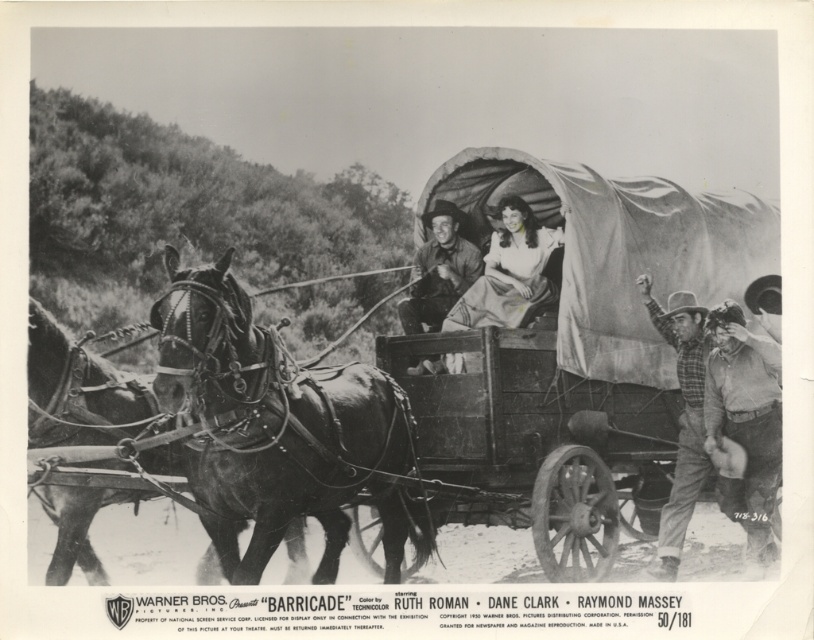
Is point (200, 356) in front of point (445, 296)?

Yes.

Who is more distant from viewer, (344,534) or (441,253)?

The point (441,253) is behind.

What do you see at coordinates (278, 429) in the screenshot? The height and width of the screenshot is (640, 814). I see `shiny black horse at center-left` at bounding box center [278, 429].

Find the location of a particular element. shiny black horse at center-left is located at coordinates (278, 429).

What do you see at coordinates (77, 390) in the screenshot?
I see `shiny black horse at left` at bounding box center [77, 390].

Which is in front, point (90, 376) or point (725, 346)?

Point (90, 376)

What are the coordinates of `shiny black horse at left` in the screenshot? It's located at (77, 390).

Is leather hat at right behind leather cowboy hat at center?

No, it is not.

Between leather hat at right and leather cowboy hat at center, which one has less height?

leather cowboy hat at center is shorter.

At what (x,y) coordinates should I click in order to perform the action: click on leather hat at right. Please return your answer as a coordinate pair (x, y). Looking at the image, I should click on (745, 419).

What are the coordinates of `leather hat at right` in the screenshot? It's located at (745, 419).